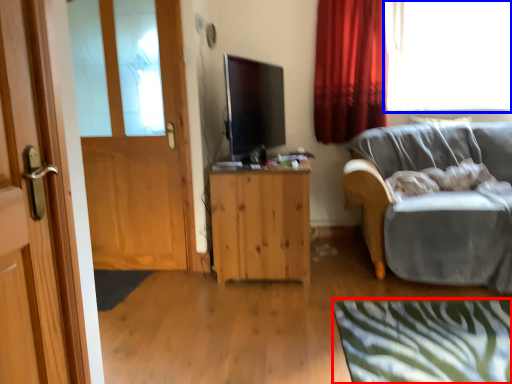
Question: Which object appears farthest to the camera in this image, plain (highlighted by a red box) or window (highlighted by a blue box)?

Choices:
 (A) plain
 (B) window

Answer: (B)